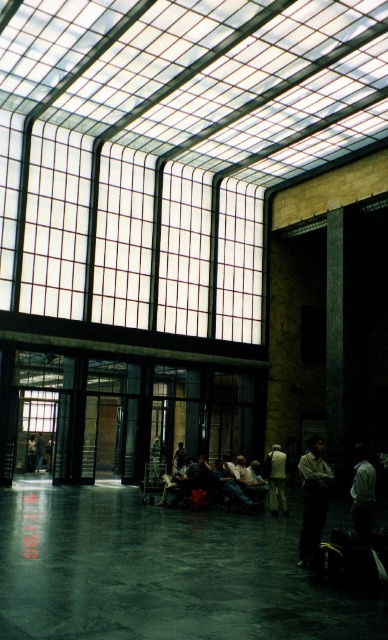
You are a delivery person standing at the dark gray jeans at lower left position. You need to deliver a package to the clear glass windows at upper center area. The delivery robot you use has a maximum range of 40 feet. Will the robot be able to reach the destination?

The clear glass windows at upper center and dark gray jeans at lower left are 39.07 feet apart. Since the robot has a maximum range of 40 feet, it can reach the destination as the distance is within its limit.

You are a photographer standing at the entrance of the building. You want to take a photo that includes both the white matte shirt at lower right and the light beige fabric jacket at center. Given that your camera has a maximum focus range of 5 meters, will you be able to capture both subjects clearly in the same frame?

The white matte shirt at lower right is 5.43 meters from the light beige fabric jacket at center. Since the distance between them exceeds the camera s 5 meter focus range, you won t be able to capture both subjects clearly in the same frame.

You are a person standing in the modern building. You see the clear glass windows at upper center and the dark gray jeans at lower left. Which object is closer to you?

The clear glass windows at upper center is closer to you because it is in front of the dark gray jeans at lower left.